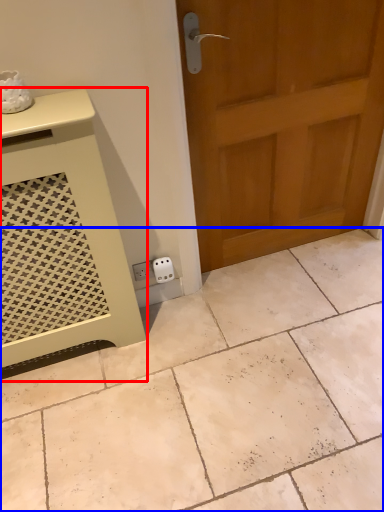
Question: Among these objects, which one is nearest to the camera, vanity (highlighted by a red box) or ceramic tile (highlighted by a blue box)?

Choices:
 (A) vanity
 (B) ceramic tile

Answer: (A)